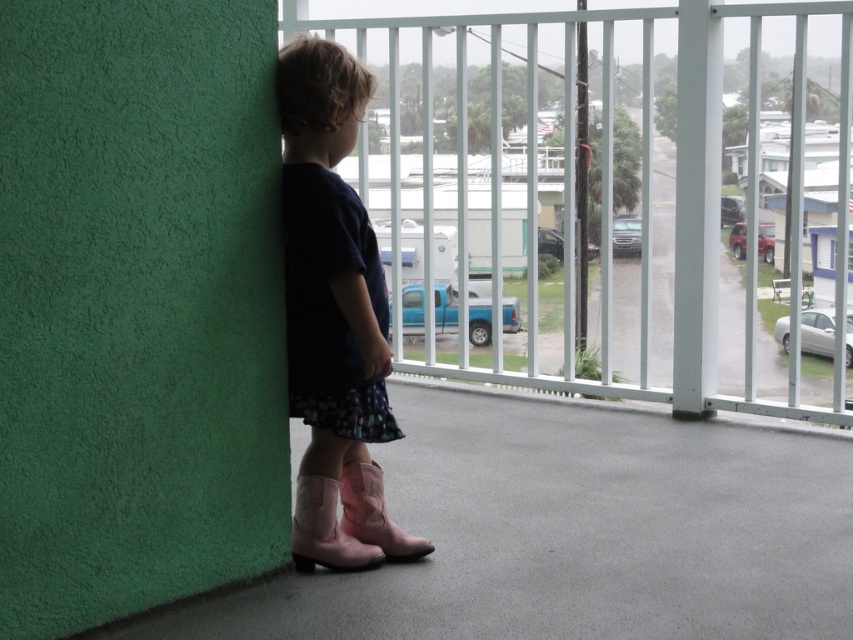
Question: Observing the image, what is the correct spatial positioning of white metal railing at upper center in reference to floral cotton dress at left?

Choices:
 (A) right
 (B) left

Answer: (A)

Question: Which point is farther to the camera?

Choices:
 (A) 692,52
 (B) 355,465
 (C) 341,556

Answer: (A)

Question: Among these objects, which one is nearest to the camera?

Choices:
 (A) pink suede boot at lower center
 (B) pink suede boot at lower left
 (C) floral cotton dress at left
 (D) white metal railing at upper center

Answer: (C)

Question: Does white metal railing at upper center appear on the left side of pink suede boots at lower left?

Choices:
 (A) no
 (B) yes

Answer: (A)

Question: Which of the following is the closest to the observer?

Choices:
 (A) pink suede boots at lower left
 (B) pink suede boot at lower left
 (C) floral cotton dress at left
 (D) pink suede boot at lower center

Answer: (C)

Question: Does floral cotton dress at left come behind pink suede boot at lower center?

Choices:
 (A) yes
 (B) no

Answer: (B)